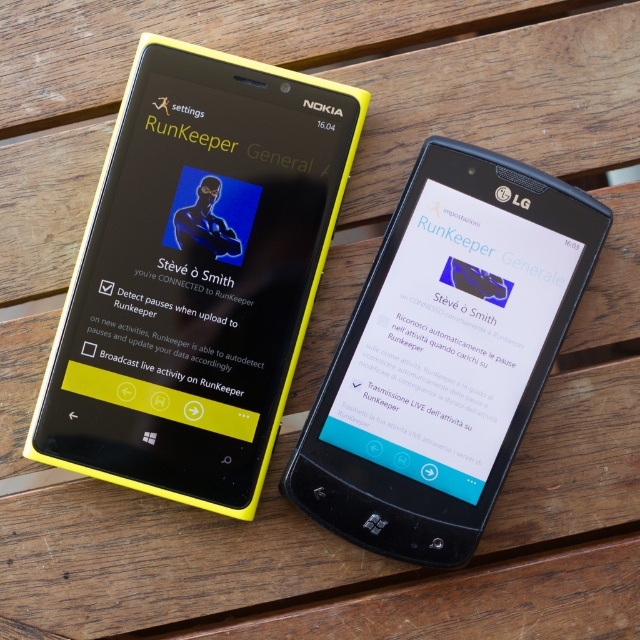
Question: Is yellow plastic nokia smartphone at left thinner than blue matte icon at center?

Choices:
 (A) no
 (B) yes

Answer: (A)

Question: Which point is farther from the camera taking this photo?

Choices:
 (A) (177, 227)
 (B) (522, 326)

Answer: (A)

Question: Is yellow plastic nokia smartphone at left to the right of blue matte icon at center from the viewer's perspective?

Choices:
 (A) yes
 (B) no

Answer: (B)

Question: Considering the real-world distances, which object is closest to the yellow plastic nokia smartphone at left?

Choices:
 (A) blue matte icon at center
 (B) black glossy lg smartphone at center

Answer: (A)

Question: Can you confirm if yellow plastic nokia smartphone at left is positioned above blue matte icon at center?

Choices:
 (A) no
 (B) yes

Answer: (A)

Question: Among these points, which one is nearest to the camera?

Choices:
 (A) (173, 204)
 (B) (400, 476)
 (C) (182, 236)

Answer: (B)